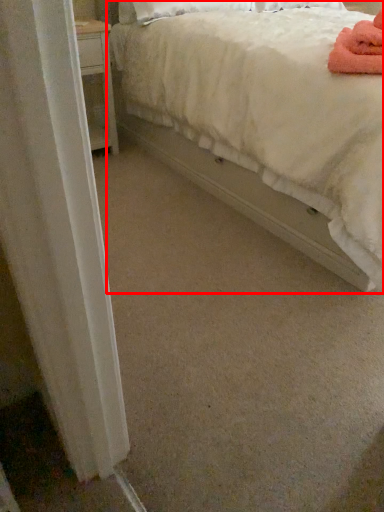
Question: Observing the image, what is the correct spatial positioning of bed (annotated by the red box) in reference to bath towel?

Choices:
 (A) right
 (B) left

Answer: (A)